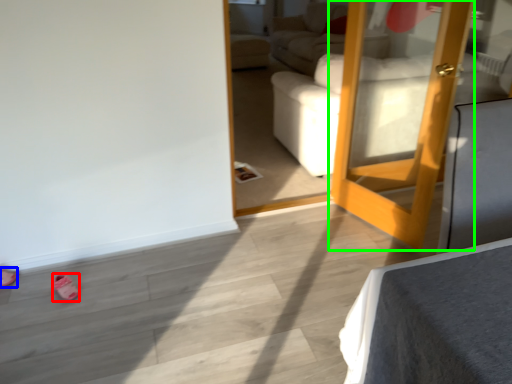
Question: Based on their relative distances, which object is farther from shoe (highlighted by a red box)? Choose from shoe (highlighted by a blue box) and door (highlighted by a green box).

Choices:
 (A) shoe
 (B) door

Answer: (B)